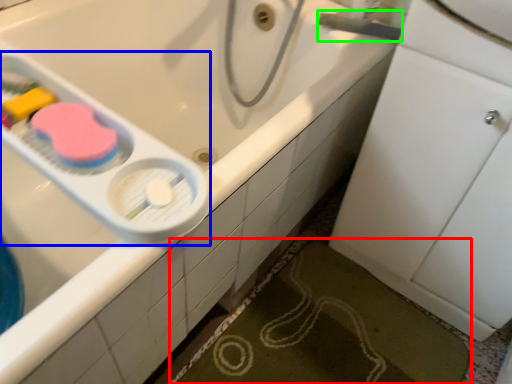
Question: Estimate the real-world distances between objects in this image. Which object is closer to bath mat (highlighted by a red box), scale (highlighted by a blue box) or plumbing fixture (highlighted by a green box)?

Choices:
 (A) scale
 (B) plumbing fixture

Answer: (A)